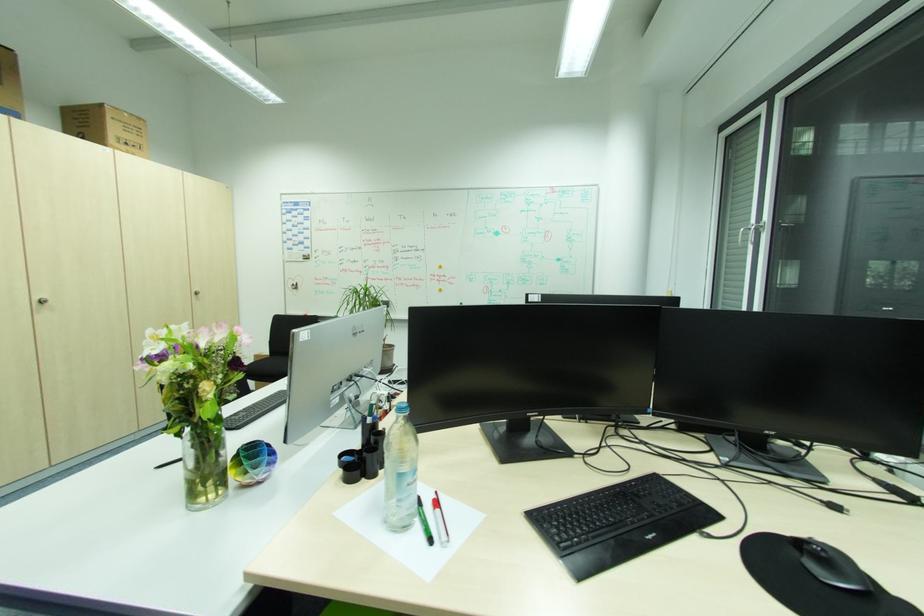
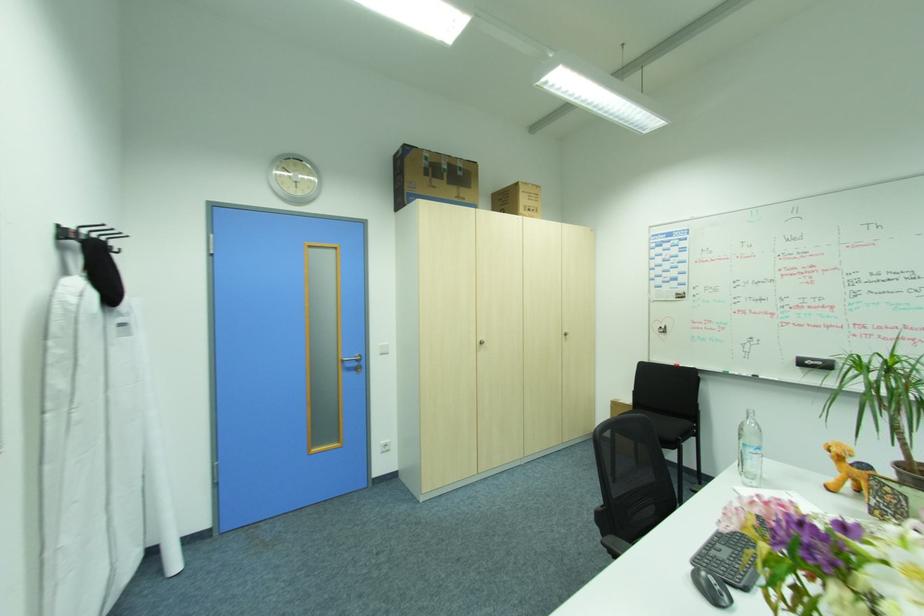
The point at [140,155] is marked in the first image. Where is the corresponding point in the second image?

(538, 217)